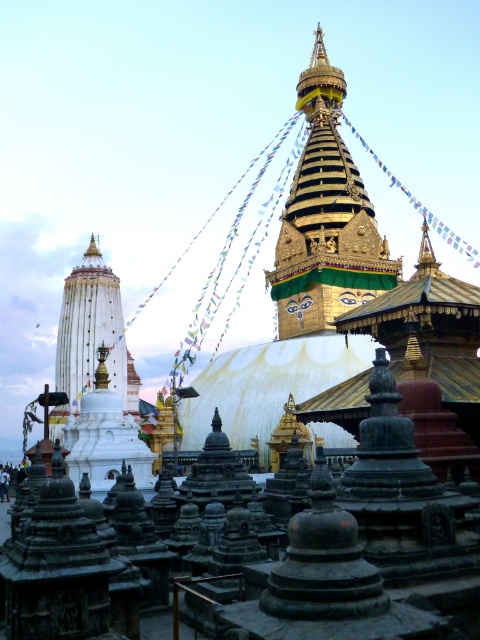
Question: Is gold/gilded stupa at center to the right of white marble stupa at left from the viewer's perspective?

Choices:
 (A) no
 (B) yes

Answer: (B)

Question: Does gold/gilded stupa at center appear on the right side of white marble stupa at left?

Choices:
 (A) no
 (B) yes

Answer: (B)

Question: Which point is closer to the camera taking this photo?

Choices:
 (A) (315, 209)
 (B) (83, 292)

Answer: (A)

Question: Among these objects, which one is farthest from the camera?

Choices:
 (A) white marble stupa at left
 (B) gold/gilded stupa at center

Answer: (A)

Question: Can you confirm if gold/gilded stupa at center is wider than white marble stupa at left?

Choices:
 (A) yes
 (B) no

Answer: (A)